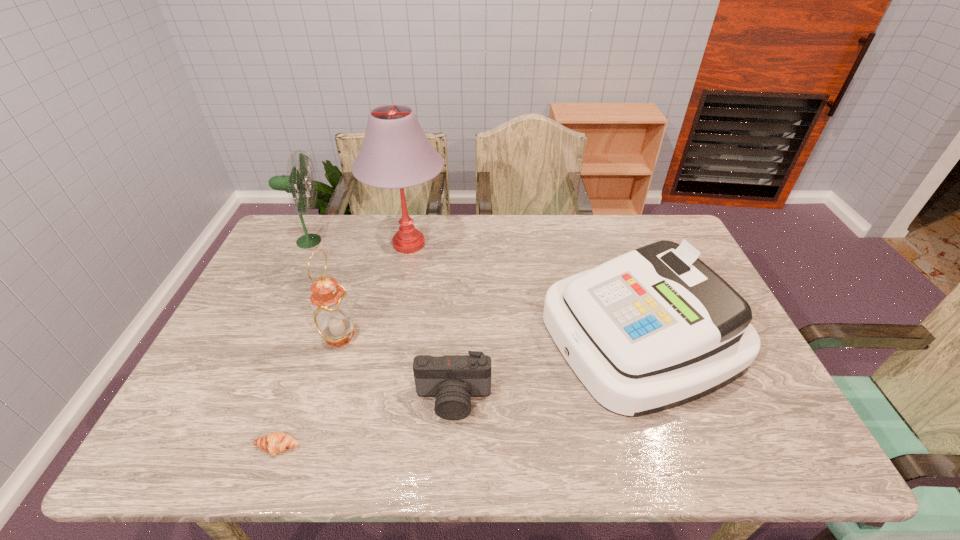
This screenshot has width=960, height=540. Find the location of `free region located 0.290m on the right of the oil lamp`. free region located 0.290m on the right of the oil lamp is located at coordinates (464, 335).

Identify the location of free spot located 0.270m on the back of the rightmost object. This screenshot has height=540, width=960. (602, 225).

Identify the location of free region located at the lens of the camera. The width and height of the screenshot is (960, 540). tap(451, 446).

Locate an element on the screen. The width and height of the screenshot is (960, 540). table lamp that is at the far edge is located at coordinates (395, 154).

The width and height of the screenshot is (960, 540). I want to click on fan that is at the far edge, so click(x=296, y=182).

You are a GUI agent. You are given a task and a screenshot of the screen. Output one action in this format:
    pyautogui.click(x=<x>, y=<y>)
    Task: Click on the object that is at the near edge
    Image resolution: width=960 pixels, height=540 pixels.
    Given the screenshot: What is the action you would take?
    pyautogui.click(x=276, y=442)

Locate an element on the screen. This screenshot has width=960, height=540. object located at the left edge is located at coordinates point(296,182).

Locate an element on the screen. The width and height of the screenshot is (960, 540). object situated at the right edge is located at coordinates (655, 328).

This screenshot has width=960, height=540. In order to click on object present at the far left corner in this screenshot , I will do `click(296, 182)`.

The image size is (960, 540). In order to click on free space at the far edge of the desktop in this screenshot , I will do `click(537, 232)`.